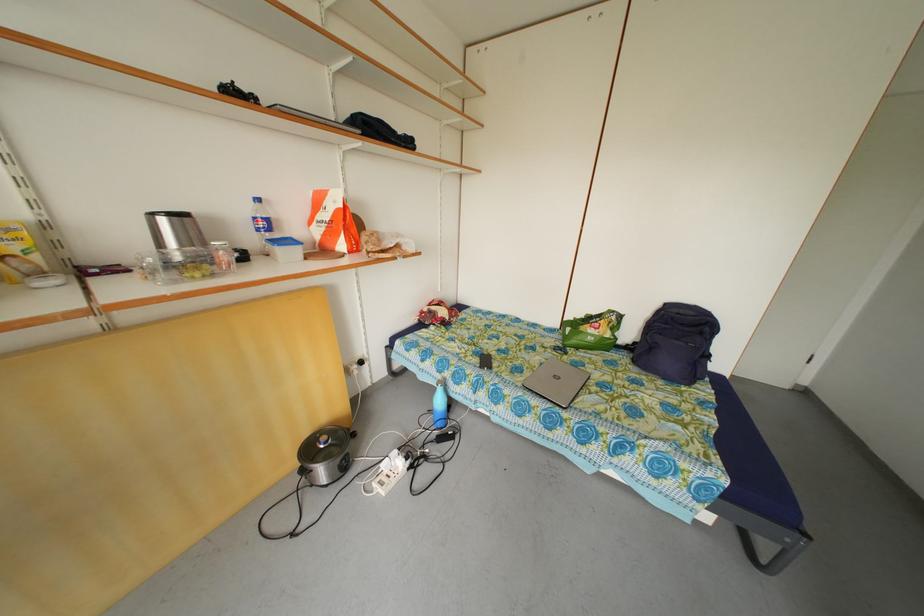
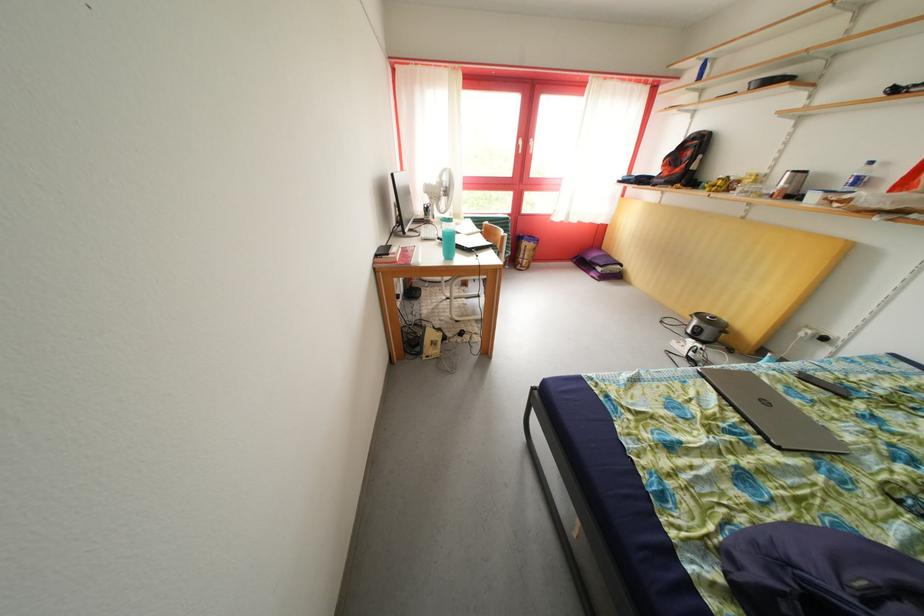
The point at (350, 474) is marked in the first image. Where is the corresponding point in the second image?

(702, 342)